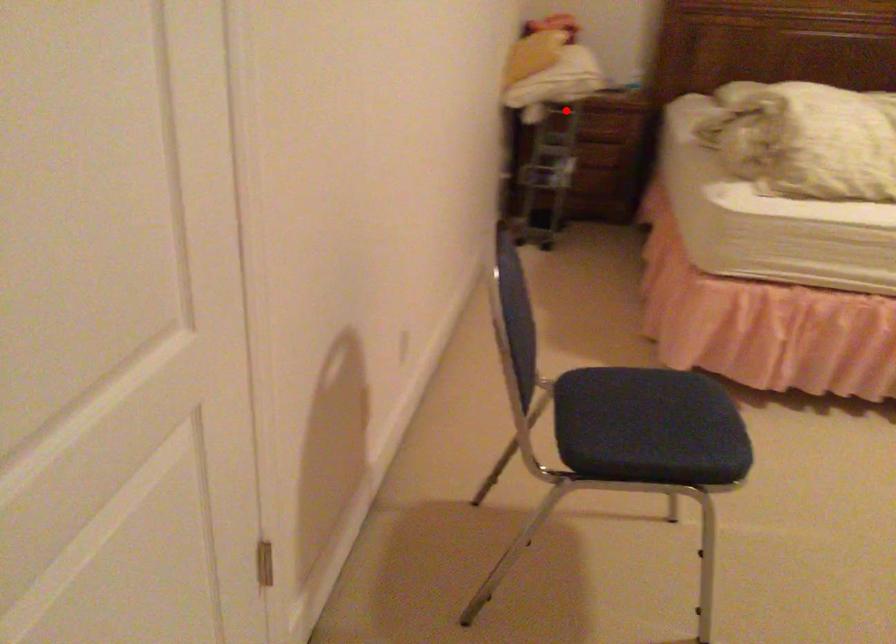
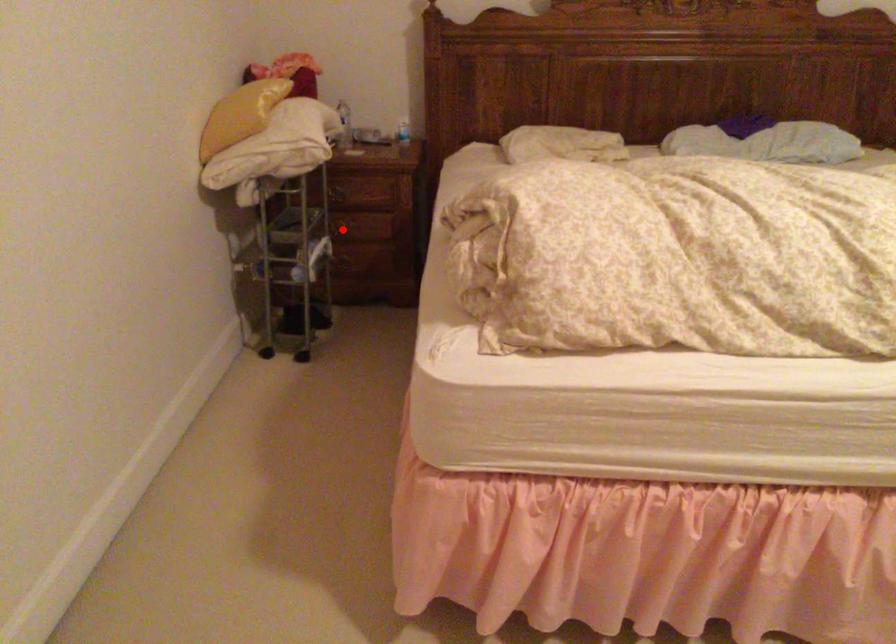
I am providing you with two images of the same scene from different viewpoints. A red point is marked on the first image and another point is marked on the second image. Are the points marked in image1 and image2 representing the same 3D position?

No